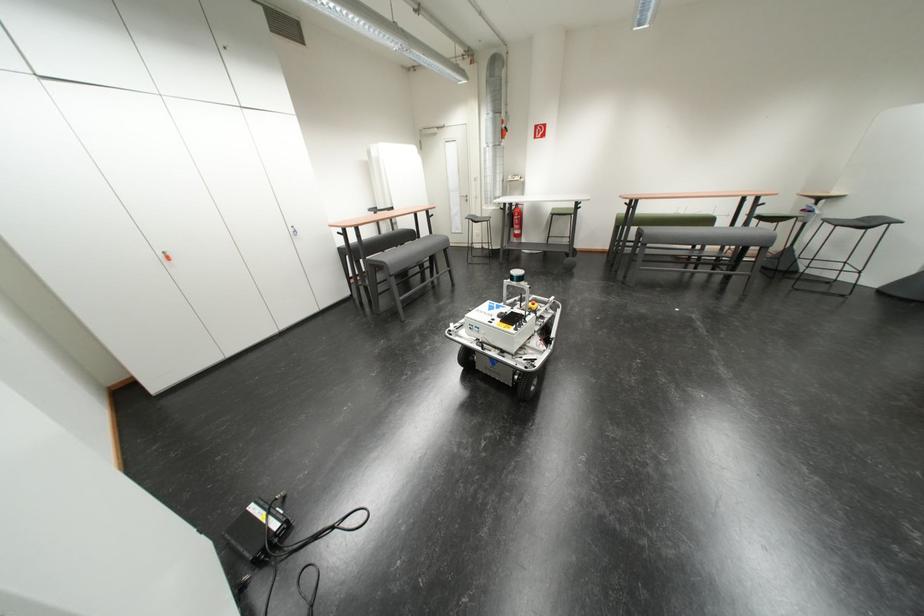
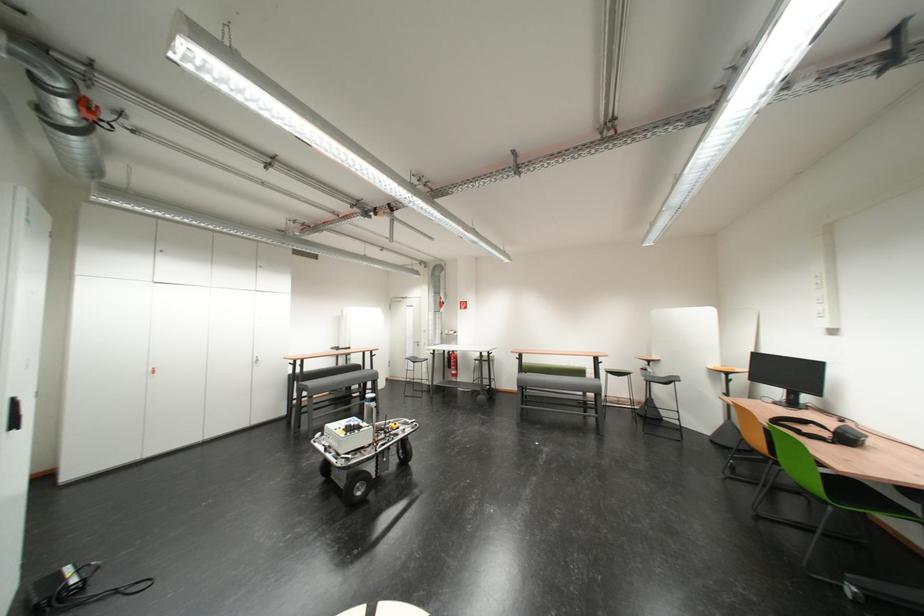
Find the pixel in the second image that matches (x=771, y=213) in the first image.

(614, 369)